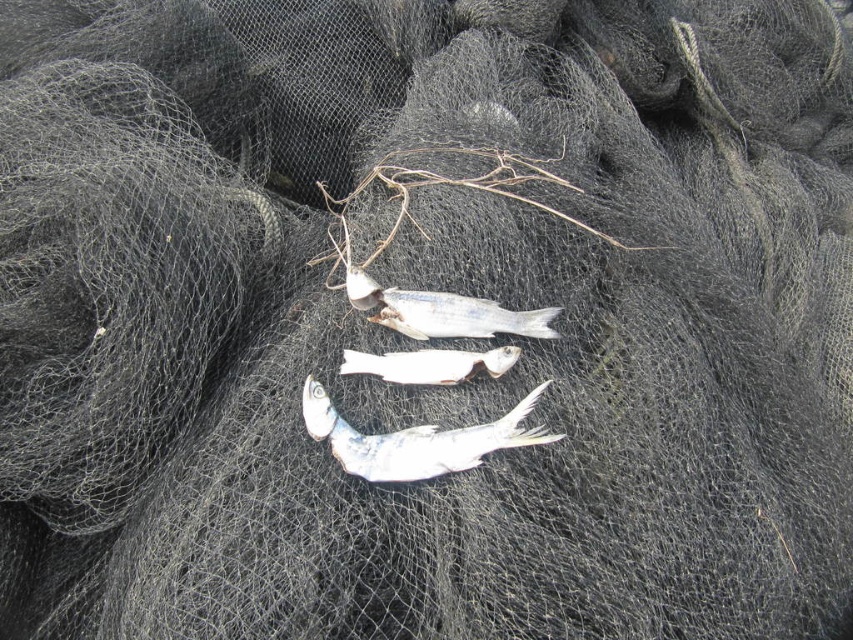
Is brown/dry wood at center taller than white matte fish at center?

Correct, brown/dry wood at center is much taller as white matte fish at center.

Is brown/dry wood at center to the left of white matte fish at center from the viewer's perspective?

Incorrect, brown/dry wood at center is not on the left side of white matte fish at center.

Image resolution: width=853 pixels, height=640 pixels. What do you see at coordinates (451, 186) in the screenshot?
I see `brown/dry wood at center` at bounding box center [451, 186].

The image size is (853, 640). I want to click on brown/dry wood at center, so click(451, 186).

Which is behind, point (370, 305) or point (471, 355)?

The point (370, 305) is more distant.

Is white matte fish at center thinner than white glossy fish at center?

No, white matte fish at center is not thinner than white glossy fish at center.

I want to click on white matte fish at center, so click(x=442, y=310).

Who is higher up, brown/dry wood at center or white glossy fish at center?

brown/dry wood at center is above.

Who is taller, brown/dry wood at center or white glossy fish at center?

With more height is brown/dry wood at center.

Between point (366, 179) and point (480, 355), which one is positioned in front?

Point (480, 355)

Image resolution: width=853 pixels, height=640 pixels. Find the location of `brown/dry wood at center`. brown/dry wood at center is located at coordinates (451, 186).